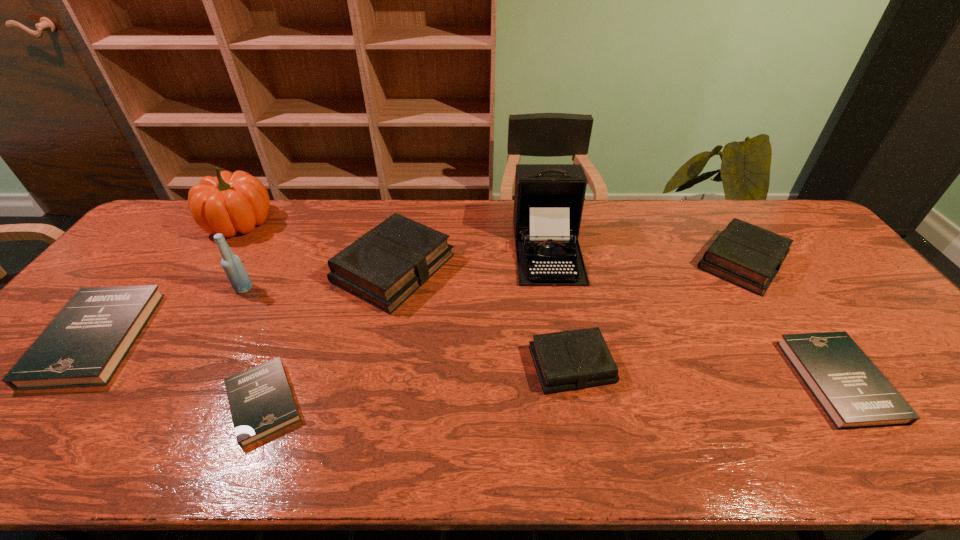
This screenshot has height=540, width=960. In order to click on vacant space located 0.320m on the back of the second greenish book from right to left in this screenshot , I will do (552, 257).

Where is `vacant space located on the right of the leftmost book`? Image resolution: width=960 pixels, height=540 pixels. vacant space located on the right of the leftmost book is located at coordinates (172, 338).

Find the location of `free point located on the left of the fifth tallest book`. free point located on the left of the fifth tallest book is located at coordinates (657, 381).

Where is `free space located on the right of the shortest book`? The width and height of the screenshot is (960, 540). free space located on the right of the shortest book is located at coordinates (444, 402).

Where is `typewriter located in the far edge section of the desktop`? The image size is (960, 540). typewriter located in the far edge section of the desktop is located at coordinates (548, 202).

You are a GUI agent. You are given a task and a screenshot of the screen. Output one action in this format:
    pyautogui.click(x=<x>, y=<y>)
    Task: Click on the pumpkin that is positioned at the far edge
    This screenshot has width=960, height=540.
    Given the screenshot: What is the action you would take?
    pyautogui.click(x=229, y=203)

Identify the location of pumpkin that is at the left edge. (229, 203).

Identify the location of book that is at the left edge. (83, 346).

This screenshot has height=540, width=960. What are the coordinates of `object at the far left corner` in the screenshot? It's located at (229, 203).

This screenshot has height=540, width=960. Find the location of `object that is at the far right corner`. object that is at the far right corner is located at coordinates (746, 255).